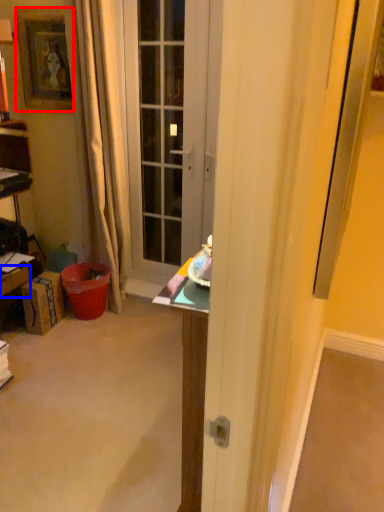
Question: Which object is further to the camera taking this photo, picture frame (highlighted by a red box) or drawer (highlighted by a blue box)?

Choices:
 (A) picture frame
 (B) drawer

Answer: (A)